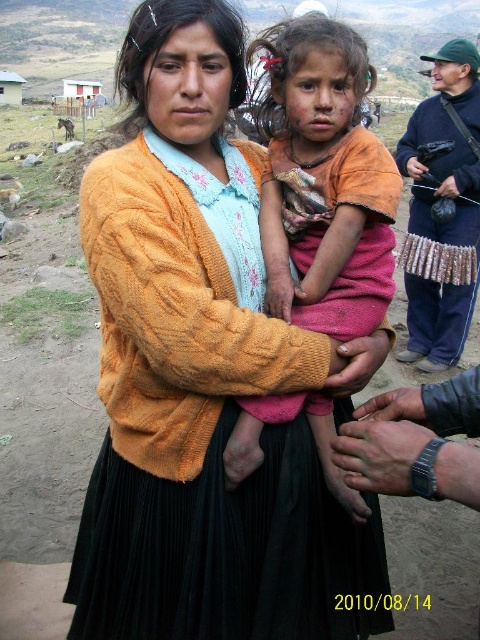
Question: Considering the relative positions of black knit dress at center and orange fabric child at center in the image provided, where is black knit dress at center located with respect to orange fabric child at center?

Choices:
 (A) below
 (B) above

Answer: (A)

Question: Which point is farther to the camera?

Choices:
 (A) black knit dress at center
 (B) metallic silver camera at right
 (C) orange fabric child at center

Answer: (B)

Question: Which point is farther to the camera?

Choices:
 (A) (456, 189)
 (B) (180, 182)

Answer: (A)

Question: Is black knit dress at center to the left of metallic silver camera at right from the viewer's perspective?

Choices:
 (A) yes
 (B) no

Answer: (A)

Question: Where is orange fabric child at center located in relation to metallic silver camera at right in the image?

Choices:
 (A) above
 (B) below

Answer: (B)

Question: Based on their relative distances, which object is nearer to the black knit dress at center?

Choices:
 (A) orange fabric child at center
 (B) metallic silver camera at right

Answer: (A)